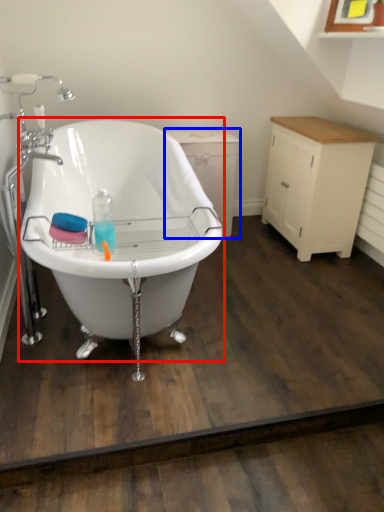
Question: Which object appears closest to the camera in this image, bathtub (highlighted by a red box) or dresser (highlighted by a blue box)?

Choices:
 (A) bathtub
 (B) dresser

Answer: (A)